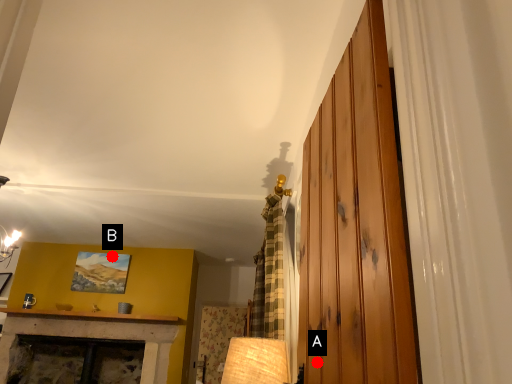
Question: Two points are circled on the image, labeled by A and B beside each circle. Which of the following is the closest to the observer?

Choices:
 (A) A is closer
 (B) B is closer

Answer: (A)